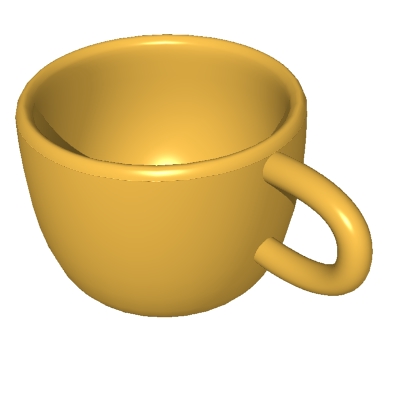
The height and width of the screenshot is (400, 400). In order to click on computer generated yellow cup in this screenshot , I will do `click(242, 195)`.